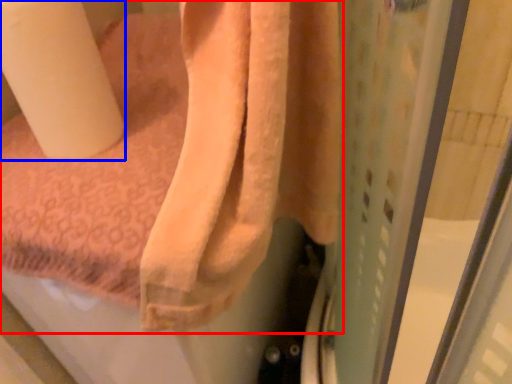
Question: Which of the following is the closest to the observer, towel (highlighted by a red box) or toilet paper (highlighted by a blue box)?

Choices:
 (A) towel
 (B) toilet paper

Answer: (A)